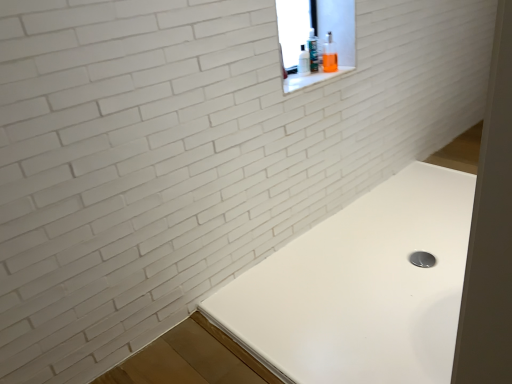
Locate an element on the screen. vacant area on top of white matte bathtub at center (from a real-world perspective) is located at coordinates (397, 255).